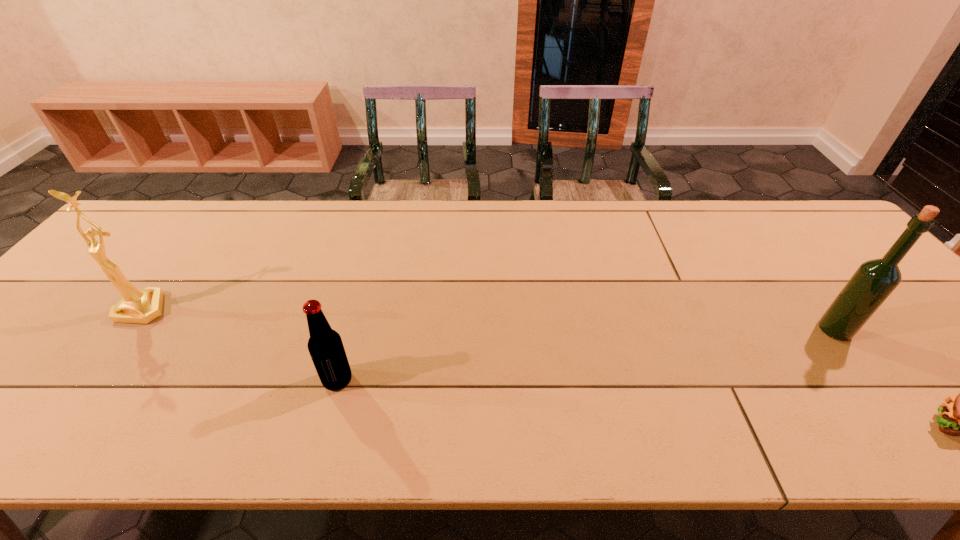
Find the location of a particular element. Image resolution: width=960 pixels, height=540 pixels. free space at the far right corner of the desktop is located at coordinates (792, 208).

Where is `vacant space in between the second object from right to left and the leftmost object`? Image resolution: width=960 pixels, height=540 pixels. vacant space in between the second object from right to left and the leftmost object is located at coordinates (489, 319).

Where is `vacant space in between the second object from right to left and the third object from right to left`? Image resolution: width=960 pixels, height=540 pixels. vacant space in between the second object from right to left and the third object from right to left is located at coordinates (587, 355).

The image size is (960, 540). What are the coordinates of `free point between the award and the third tallest object` in the screenshot? It's located at (241, 344).

Locate which object ranks second in proximity to the award. Please provide its 2D coordinates. Your answer should be formatted as a tuple, i.e. [(x, y)], where the tuple contains the x and y coordinates of a point satisfying the conditions above.

[(874, 280)]

Identify which object is the closest to the award. Please provide its 2D coordinates. Your answer should be formatted as a tuple, i.e. [(x, y)], where the tuple contains the x and y coordinates of a point satisfying the conditions above.

[(325, 345)]

Locate an element on the screen. This screenshot has height=540, width=960. free spot that satisfies the following two spatial constraints: 1. on the back side of the third object from left to right; 2. on the left side of the third object from right to left is located at coordinates (351, 330).

The width and height of the screenshot is (960, 540). What are the coordinates of `blank area in the image that satisfies the following two spatial constraints: 1. on the front-facing side of the leftmost object; 2. on the left side of the second object from right to left` in the screenshot? It's located at point(127,330).

Find the location of `vacant space that satisfies the following two spatial constraints: 1. on the front-facing side of the third object from left to right; 2. on the left side of the award`. vacant space that satisfies the following two spatial constraints: 1. on the front-facing side of the third object from left to right; 2. on the left side of the award is located at coordinates (127, 330).